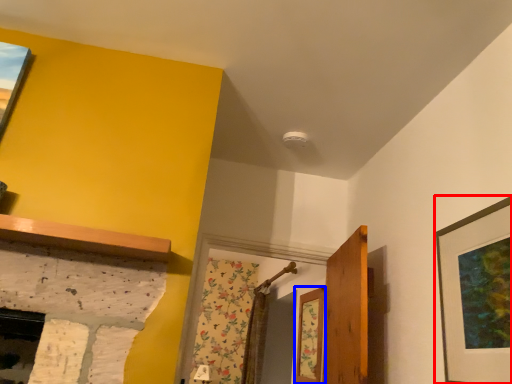
Question: Among these objects, which one is farthest to the camera, picture frame (highlighted by a red box) or window (highlighted by a blue box)?

Choices:
 (A) picture frame
 (B) window

Answer: (B)